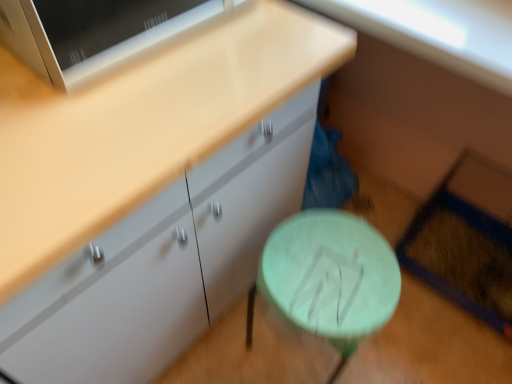
Locate an element on the screen. The image size is (512, 384). vacant area located to the right-hand side of green matte table at lower center is located at coordinates (410, 346).